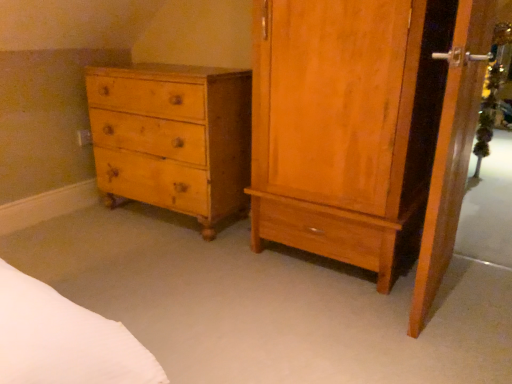
Find the location of a particular element. The height and width of the screenshot is (384, 512). free space in front of light brown wood cabinet at right is located at coordinates (338, 327).